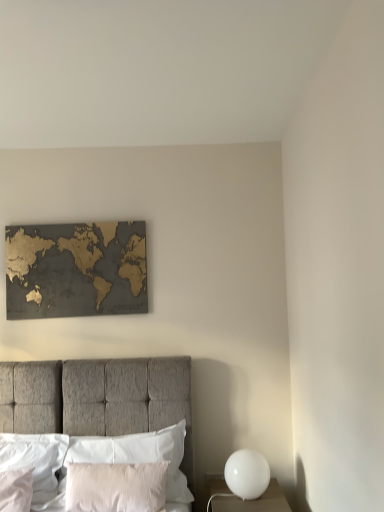
Question: Is gold metallic map at upper center aimed at silky white pillow at center, the 4th pillow when ordered from left to right?

Choices:
 (A) no
 (B) yes

Answer: (A)

Question: Is gold metallic map at upper center bigger than silky white pillow at center, the 1th pillow in the right-to-left sequence?

Choices:
 (A) no
 (B) yes

Answer: (A)

Question: Is gold metallic map at upper center taller than silky white pillow at center, the 4th pillow when ordered from left to right?

Choices:
 (A) yes
 (B) no

Answer: (A)

Question: Can you confirm if gold metallic map at upper center is positioned to the right of silky white pillow at center, the 4th pillow when ordered from left to right?

Choices:
 (A) yes
 (B) no

Answer: (B)

Question: From a real-world perspective, is gold metallic map at upper center over silky white pillow at center, the 1th pillow in the right-to-left sequence?

Choices:
 (A) no
 (B) yes

Answer: (B)

Question: Can you confirm if gold metallic map at upper center is positioned to the left of silky white pillow at center, the 1th pillow in the right-to-left sequence?

Choices:
 (A) yes
 (B) no

Answer: (A)

Question: Is white glossy sphere at lower right completely or partially inside white satin pillow at lower left, the 1th pillow from the left?

Choices:
 (A) no
 (B) yes

Answer: (A)

Question: Is white satin pillow at lower left, the 1th pillow from the left, looking in the opposite direction of white glossy sphere at lower right?

Choices:
 (A) no
 (B) yes

Answer: (A)

Question: Can you confirm if white satin pillow at lower left, the 1th pillow from the left, is shorter than white glossy sphere at lower right?

Choices:
 (A) yes
 (B) no

Answer: (B)

Question: Does white satin pillow at lower left, the 4th pillow in the right-to-left sequence, have a smaller size compared to white glossy sphere at lower right?

Choices:
 (A) no
 (B) yes

Answer: (B)

Question: From the image's perspective, is white satin pillow at lower left, the 4th pillow in the right-to-left sequence, above white glossy sphere at lower right?

Choices:
 (A) no
 (B) yes

Answer: (B)

Question: Considering the relative positions of white satin pillow at lower left, the 4th pillow in the right-to-left sequence, and white glossy sphere at lower right in the image provided, is white satin pillow at lower left, the 4th pillow in the right-to-left sequence, to the left of white glossy sphere at lower right from the viewer's perspective?

Choices:
 (A) yes
 (B) no

Answer: (A)

Question: Is silky white pillow at center, the 1th pillow in the right-to-left sequence, located within textured gray bed at center?

Choices:
 (A) no
 (B) yes

Answer: (B)